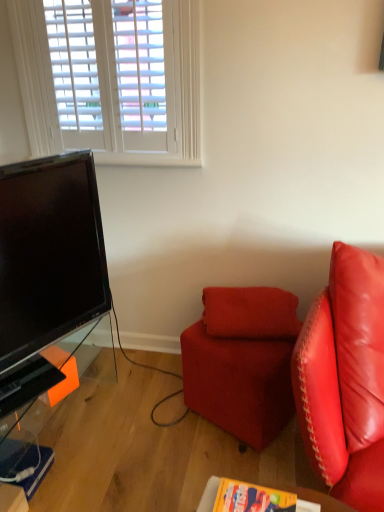
Question: From a real-world perspective, is suede-like red pillow at center located beneath velvet red ottoman at center?

Choices:
 (A) yes
 (B) no

Answer: (B)

Question: Can you confirm if suede-like red pillow at center is wider than velvet red ottoman at center?

Choices:
 (A) yes
 (B) no

Answer: (B)

Question: Is suede-like red pillow at center not close to velvet red ottoman at center?

Choices:
 (A) no
 (B) yes

Answer: (A)

Question: From a real-world perspective, is suede-like red pillow at center physically above velvet red ottoman at center?

Choices:
 (A) yes
 (B) no

Answer: (A)

Question: From the image's perspective, is suede-like red pillow at center under velvet red ottoman at center?

Choices:
 (A) yes
 (B) no

Answer: (B)

Question: In terms of width, does wooden table at lower center, which is counted as the first table, starting from the front, look wider or thinner when compared to velvet red ottoman at center?

Choices:
 (A) wide
 (B) thin

Answer: (B)

Question: From the image's perspective, is wooden table at lower center, which appears as the second table when viewed from the left, above or below velvet red ottoman at center?

Choices:
 (A) above
 (B) below

Answer: (B)

Question: Choose the correct answer: Is wooden table at lower center, which ranks as the 1th table in right-to-left order, inside velvet red ottoman at center or outside it?

Choices:
 (A) outside
 (B) inside

Answer: (A)

Question: Does point (331, 509) appear closer or farther from the camera than point (226, 404)?

Choices:
 (A) farther
 (B) closer

Answer: (B)

Question: Is transparent glass table at lower left, positioned as the 2th table in front-to-back order, bigger or smaller than velvet red ottoman at center?

Choices:
 (A) big
 (B) small

Answer: (A)

Question: Considering the positions of point (56, 349) and point (248, 418), is point (56, 349) closer or farther from the camera than point (248, 418)?

Choices:
 (A) closer
 (B) farther

Answer: (B)

Question: From a real-world perspective, relative to velvet red ottoman at center, is transparent glass table at lower left, positioned as the 2th table in front-to-back order, vertically above or below?

Choices:
 (A) above
 (B) below

Answer: (B)

Question: Visually, is transparent glass table at lower left, the second table in the right-to-left sequence, positioned to the left or to the right of velvet red ottoman at center?

Choices:
 (A) left
 (B) right

Answer: (A)

Question: Do you think suede-like red pillow at center is within transparent glass table at lower left, positioned as the 2th table in front-to-back order, or outside of it?

Choices:
 (A) outside
 (B) inside

Answer: (A)

Question: Is point (243, 296) positioned closer to the camera than point (18, 465)?

Choices:
 (A) closer
 (B) farther

Answer: (B)